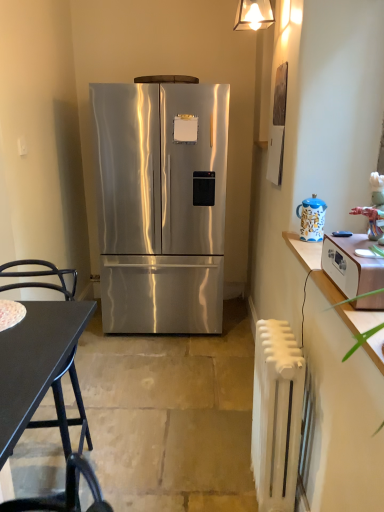
I want to click on matte glass lampshade at upper center, so click(x=253, y=15).

Describe the element at coordinates (351, 265) in the screenshot. I see `wooden toaster at right` at that location.

The image size is (384, 512). I want to click on matte glass lampshade at upper center, so click(253, 15).

Which object is positioned more to the left, white painted metal radiator at right or blue ceramic teapot at right?

Positioned to the left is white painted metal radiator at right.

From a real-world perspective, is white painted metal radiator at right physically located above or below blue ceramic teapot at right?

In terms of real-world spatial position, white painted metal radiator at right is below blue ceramic teapot at right.

Choose the correct answer: Is white painted metal radiator at right inside blue ceramic teapot at right or outside it?

white painted metal radiator at right is not inside blue ceramic teapot at right, it's outside.

Looking at this image, is white painted metal radiator at right wider than blue ceramic teapot at right?

Indeed, white painted metal radiator at right has a greater width compared to blue ceramic teapot at right.

From the image's perspective, is matte glass lampshade at upper center below wooden toaster at right?

Actually, matte glass lampshade at upper center appears above wooden toaster at right in the image.

Locate an element on the screen. This screenshot has width=384, height=512. lamp that is on the left side of wooden toaster at right is located at coordinates (253, 15).

Does point (262, 1) come farther from viewer compared to point (376, 258)?

Yes, it is behind point (376, 258).

Considering the sizes of matte glass lampshade at upper center and wooden toaster at right in the image, is matte glass lampshade at upper center bigger or smaller than wooden toaster at right?

matte glass lampshade at upper center is smaller than wooden toaster at right.

How much distance is there between wooden toaster at right and stainless steel refrigerator at center?

A distance of 5.06 feet exists between wooden toaster at right and stainless steel refrigerator at center.

Is wooden toaster at right at the right side of stainless steel refrigerator at center?

Correct, you'll find wooden toaster at right to the right of stainless steel refrigerator at center.

Can you see wooden toaster at right touching stainless steel refrigerator at center?

wooden toaster at right and stainless steel refrigerator at center are not in contact.

From the image's perspective, which object appears higher, blue ceramic teapot at right or matte glass lampshade at upper center?

matte glass lampshade at upper center.

Can you tell me how much blue ceramic teapot at right and matte glass lampshade at upper center differ in facing direction?

They differ by 1.67 degrees in their facing directions.

Does blue ceramic teapot at right have a larger size compared to matte glass lampshade at upper center?

Incorrect, blue ceramic teapot at right is not larger than matte glass lampshade at upper center.

Is black matte desk at lower left completely or partially inside blue ceramic teapot at right?

Actually, black matte desk at lower left is outside blue ceramic teapot at right.

Considering the sizes of objects blue ceramic teapot at right and black matte desk at lower left in the image provided, who is thinner, blue ceramic teapot at right or black matte desk at lower left?

blue ceramic teapot at right is thinner.

Which is closer, (x=301, y=230) or (x=66, y=317)?

The point (x=66, y=317) is more forward.

From the image's perspective, which one is positioned higher, blue ceramic teapot at right or black matte desk at lower left?

blue ceramic teapot at right.

Consider the image. Between matte glass lampshade at upper center and white painted metal radiator at right, which one appears on the right side from the viewer's perspective?

From the viewer's perspective, matte glass lampshade at upper center appears more on the right side.

From a real-world perspective, is matte glass lampshade at upper center beneath white painted metal radiator at right?

Actually, matte glass lampshade at upper center is physically above white painted metal radiator at right in the real world.

Is matte glass lampshade at upper center positioned with its back to white painted metal radiator at right?

No, matte glass lampshade at upper center is not facing away from white painted metal radiator at right.

Is stainless steel refrigerator at center surrounded by blue ceramic teapot at right?

No, blue ceramic teapot at right does not contain stainless steel refrigerator at center.

Does blue ceramic teapot at right have a lesser height compared to stainless steel refrigerator at center?

Correct, blue ceramic teapot at right is not as tall as stainless steel refrigerator at center.

From a real-world perspective, is blue ceramic teapot at right physically located above or below stainless steel refrigerator at center?

From a real-world perspective, blue ceramic teapot at right is physically above stainless steel refrigerator at center.

Locate an element on the screen. radiator below the blue ceramic teapot at right (from the image's perspective) is located at coordinates click(x=276, y=414).

Locate an element on the screen. This screenshot has height=512, width=384. toaster below the matte glass lampshade at upper center (from a real-world perspective) is located at coordinates coord(351,265).

Based on their spatial positions, is matte glass lampshade at upper center or stainless steel refrigerator at center further from white wood cabinet at right?

matte glass lampshade at upper center is further to white wood cabinet at right.

From the picture: From the image, which object appears to be farther from blue ceramic teapot at right, wooden toaster at right or black matte desk at lower left?

black matte desk at lower left.

In the scene shown: Which object lies nearer to the anchor point wooden toaster at right, stainless steel refrigerator at center or matte glass lampshade at upper center?

stainless steel refrigerator at center lies closer to wooden toaster at right than the other object.

Based on their spatial positions, is stainless steel refrigerator at center or white painted metal radiator at right further from wooden toaster at right?

Among the two, stainless steel refrigerator at center is located further to wooden toaster at right.

In the scene shown: From the image, which object appears to be nearer to black matte desk at lower left, white painted metal radiator at right or blue ceramic teapot at right?

white painted metal radiator at right.

Based on their spatial positions, is white painted metal radiator at right or matte glass lampshade at upper center closer to wooden toaster at right?

white painted metal radiator at right lies closer to wooden toaster at right than the other object.

Estimate the real-world distances between objects in this image. Which object is further from white wood cabinet at right, stainless steel refrigerator at center or matte glass lampshade at upper center?

matte glass lampshade at upper center lies further to white wood cabinet at right than the other object.

Looking at the image, which one is located further to wooden toaster at right, matte glass lampshade at upper center or white painted metal radiator at right?

matte glass lampshade at upper center is further to wooden toaster at right.

You are a GUI agent. You are given a task and a screenshot of the screen. Output one action in this format:
    pyautogui.click(x=<x>, y=<y>)
    Task: Click on the desk located between wooden toaster at right and stainless steel refrigerator at center in the depth direction
    
    Given the screenshot: What is the action you would take?
    pyautogui.click(x=35, y=361)

Identify the location of radiator located between black matte desk at lower left and blue ceramic teapot at right in the left-right direction. The image size is (384, 512). (276, 414).

Find the location of a particular element. toaster between white wood cabinet at right and blue ceramic teapot at right in the front-back direction is located at coordinates (351, 265).

Identify the location of toaster between white wood cabinet at right and white painted metal radiator at right in the front-back direction. Image resolution: width=384 pixels, height=512 pixels. (351, 265).